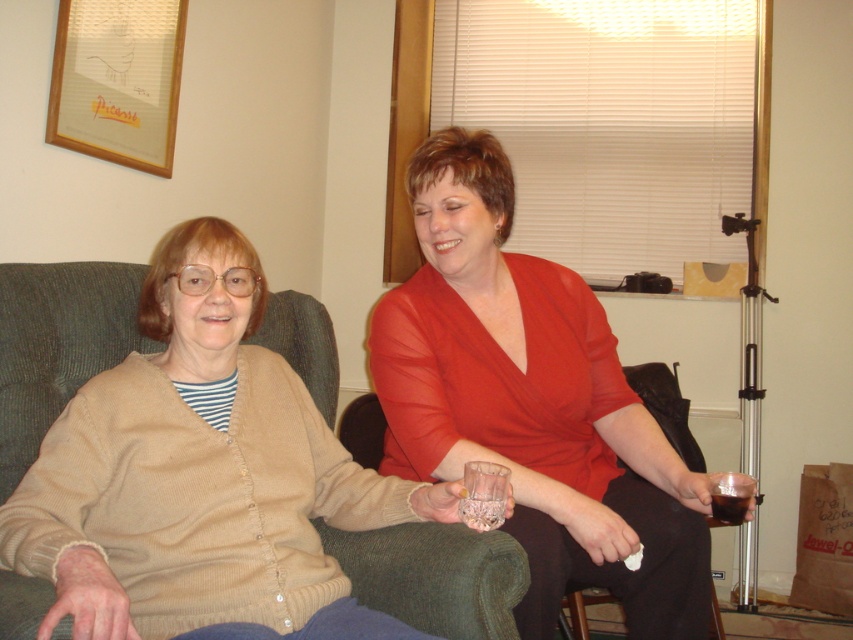
Question: Which point appears closest to the camera in this image?

Choices:
 (A) (672, 477)
 (B) (125, 275)

Answer: (A)

Question: Where is matte glass at center located in relation to beige knit cardigan at center in the image?

Choices:
 (A) above
 (B) below

Answer: (A)

Question: Is matte glass at center below beige knit cardigan at center?

Choices:
 (A) no
 (B) yes

Answer: (A)

Question: Can you confirm if matte glass at center is positioned below beige knit cardigan at center?

Choices:
 (A) no
 (B) yes

Answer: (A)

Question: Which point is closer to the camera?

Choices:
 (A) (476, 566)
 (B) (570, 557)

Answer: (A)